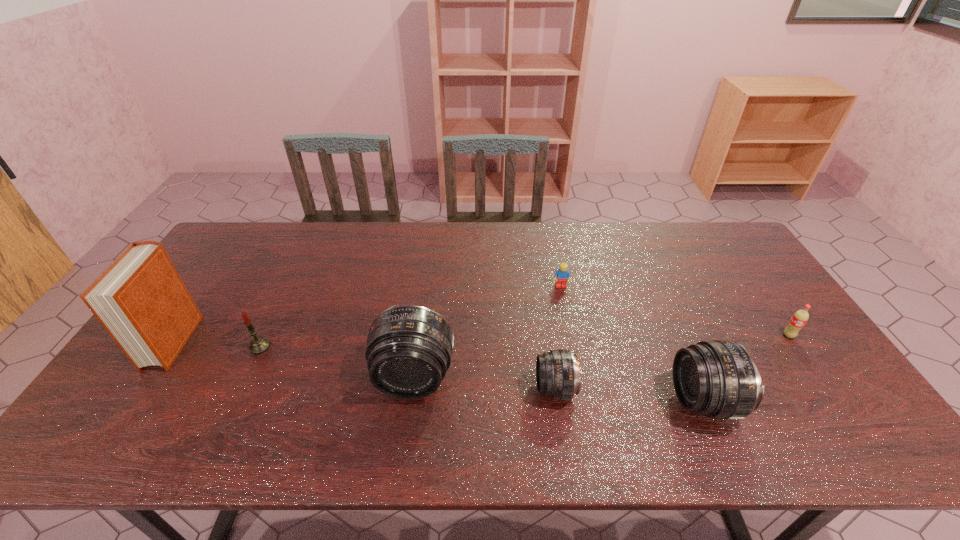
Locate an element on the screen. The image size is (960, 540). vacant space located at the front element of the shortest telephoto lens is located at coordinates (389, 389).

Locate an element on the screen. This screenshot has height=540, width=960. vacant area situated at the front element of the shortest telephoto lens is located at coordinates (472, 389).

Where is `vacant space situated at the front element of the shortest telephoto lens`? The image size is (960, 540). vacant space situated at the front element of the shortest telephoto lens is located at coordinates (429, 389).

Locate an element on the screen. The image size is (960, 540). vacant space located 0.100m at the front element of the second tallest telephoto lens is located at coordinates (634, 401).

The image size is (960, 540). Find the location of `free space located 0.360m at the front element of the second tallest telephoto lens`. free space located 0.360m at the front element of the second tallest telephoto lens is located at coordinates (528, 401).

Where is `free spot located 0.390m at the front element of the second tallest telephoto lens`? free spot located 0.390m at the front element of the second tallest telephoto lens is located at coordinates (516, 401).

Find the location of `free spot located on the face of the farthest object`. free spot located on the face of the farthest object is located at coordinates (569, 327).

Where is `free space located on the front of the candle`? free space located on the front of the candle is located at coordinates (248, 373).

The width and height of the screenshot is (960, 540). I want to click on vacant space located 0.070m on the back of the soda, so click(x=774, y=313).

Locate an element on the screen. Image resolution: width=960 pixels, height=540 pixels. free space located on the open cover of the leftmost object is located at coordinates (135, 399).